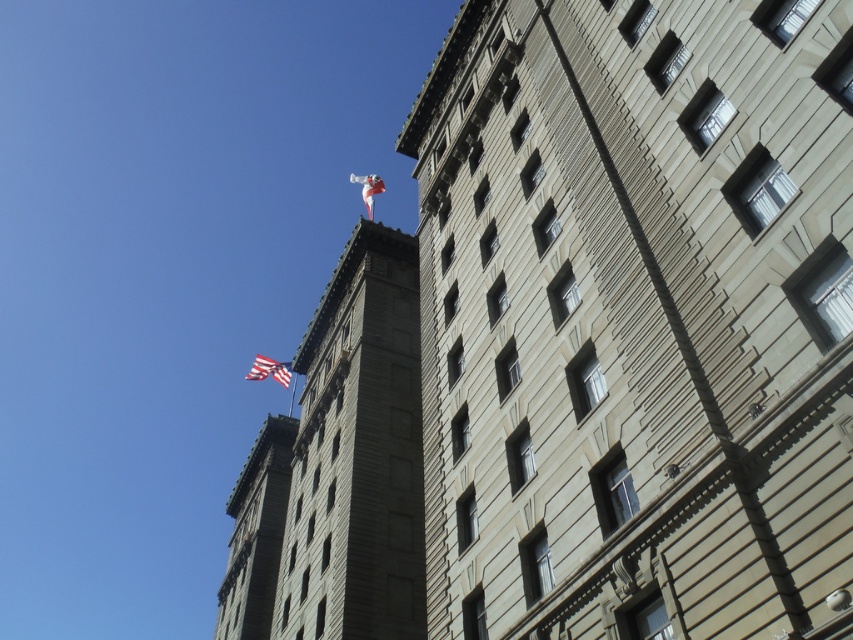
Does smooth stone tower at upper center appear on the right side of american flag at upper left?

Indeed, smooth stone tower at upper center is positioned on the right side of american flag at upper left.

Is point (303, 480) closer to camera compared to point (256, 365)?

Yes, it is.

What do you see at coordinates (358, 452) in the screenshot? I see `smooth stone tower at upper center` at bounding box center [358, 452].

You are a GUI agent. You are given a task and a screenshot of the screen. Output one action in this format:
    pyautogui.click(x=<x>, y=<y>)
    Task: Click on the smooth stone tower at upper center
    
    Given the screenshot: What is the action you would take?
    pyautogui.click(x=358, y=452)

Can you confirm if smooth stone tower at upper center is positioned to the left of white fabric flag at upper center?

In fact, smooth stone tower at upper center is to the right of white fabric flag at upper center.

Can you confirm if smooth stone tower at upper center is shorter than white fabric flag at upper center?

Indeed, smooth stone tower at upper center has a lesser height compared to white fabric flag at upper center.

Between point (364, 404) and point (366, 198), which one is positioned behind?

The point (366, 198) is more distant.

I want to click on smooth stone tower at upper center, so click(358, 452).

Who is more forward, (239, 593) or (368, 177)?

Point (239, 593) is more forward.

Can you confirm if red flag at upper left is smaller than white fabric flag at upper center?

Yes, red flag at upper left is smaller than white fabric flag at upper center.

At what (x,y) coordinates should I click in order to perform the action: click on red flag at upper left. Please return your answer as a coordinate pair (x, y). This screenshot has height=640, width=853. Looking at the image, I should click on (256, 532).